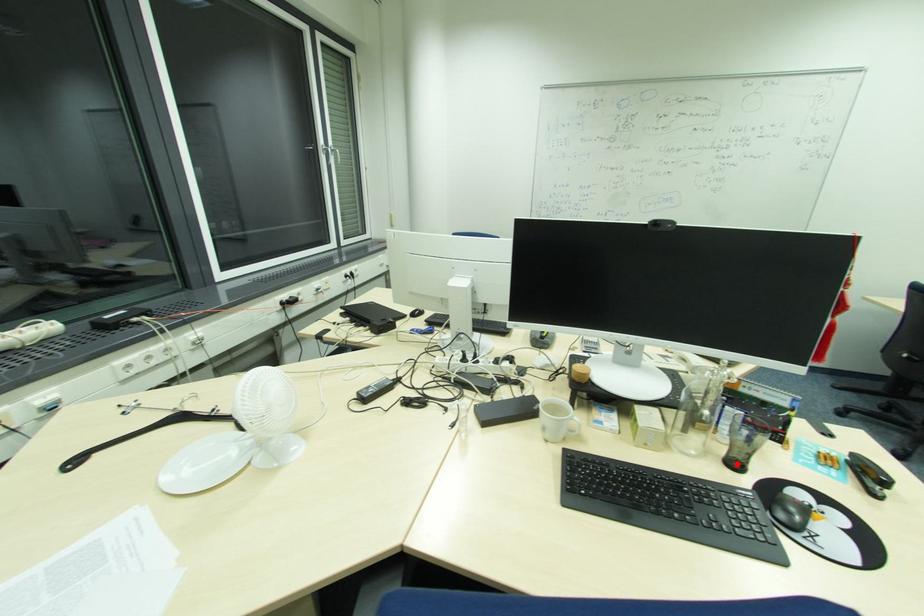
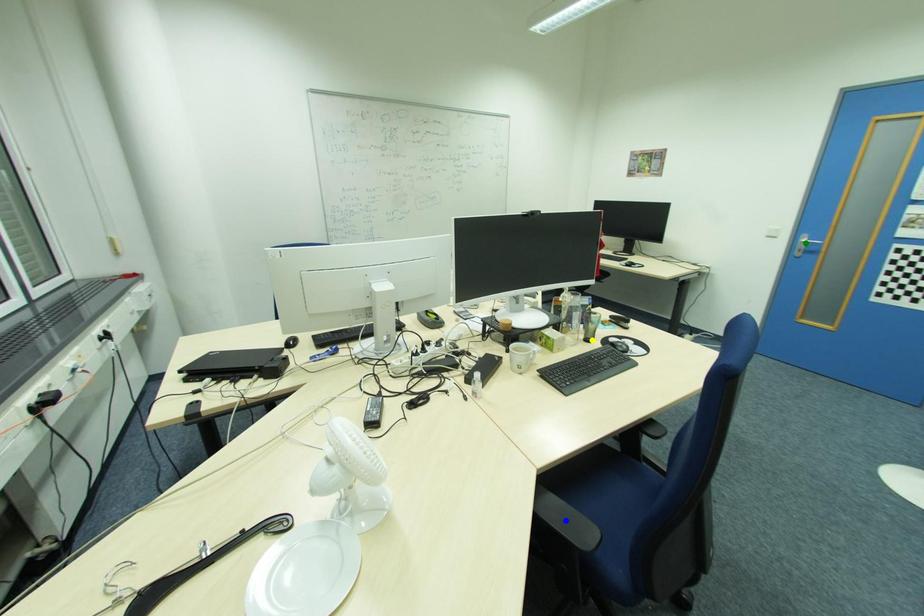
Question: I am providing you with two images of the same scene from different viewpoints. A red point is marked on the first image. You are given multiple points on the second image. Which point in image 2 is actually the same real-world point as the red point in image 1?

Choices:
 (A) green point
 (B) blue point
 (C) yellow point

Answer: (C)